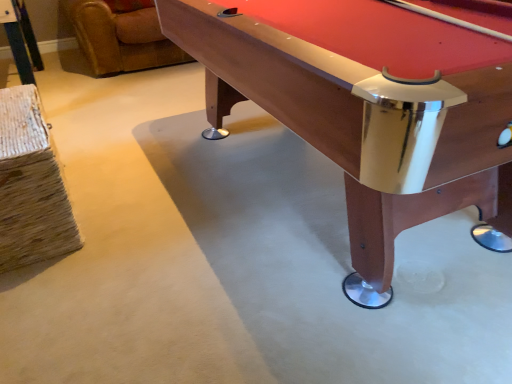
Question: Would you say brown leather swivel chair at upper left is outside wooden pool table at center?

Choices:
 (A) yes
 (B) no

Answer: (A)

Question: From a real-world perspective, does brown leather swivel chair at upper left sit lower than wooden pool table at center?

Choices:
 (A) yes
 (B) no

Answer: (A)

Question: Is brown leather swivel chair at upper left beside wooden pool table at center?

Choices:
 (A) no
 (B) yes

Answer: (A)

Question: From the image's perspective, is brown leather swivel chair at upper left beneath wooden pool table at center?

Choices:
 (A) no
 (B) yes

Answer: (A)

Question: Does brown leather swivel chair at upper left have a lesser width compared to wooden pool table at center?

Choices:
 (A) no
 (B) yes

Answer: (A)

Question: Would you say brown leather swivel chair at upper left contains wooden pool table at center?

Choices:
 (A) no
 (B) yes

Answer: (A)

Question: Could you tell me if wooden pool table at center is turned towards brown leather swivel chair at upper left?

Choices:
 (A) yes
 (B) no

Answer: (B)

Question: Is wooden pool table at center thinner than brown leather swivel chair at upper left?

Choices:
 (A) yes
 (B) no

Answer: (A)

Question: Is wooden pool table at center turned away from brown leather swivel chair at upper left?

Choices:
 (A) yes
 (B) no

Answer: (B)

Question: From the image's perspective, would you say wooden pool table at center is shown under brown leather swivel chair at upper left?

Choices:
 (A) no
 (B) yes

Answer: (B)

Question: From a real-world perspective, is wooden pool table at center located beneath brown leather swivel chair at upper left?

Choices:
 (A) no
 (B) yes

Answer: (A)

Question: From the image's perspective, is wooden pool table at center located above brown leather swivel chair at upper left?

Choices:
 (A) yes
 (B) no

Answer: (B)

Question: In the image, is wooden pool table at center positioned in front of or behind brown leather swivel chair at upper left?

Choices:
 (A) front
 (B) behind

Answer: (A)